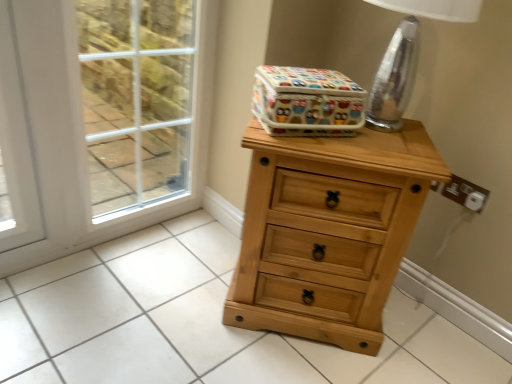
Identify the location of vacant space in front of clear glass table lamp at upper right. Image resolution: width=512 pixels, height=384 pixels. (379, 148).